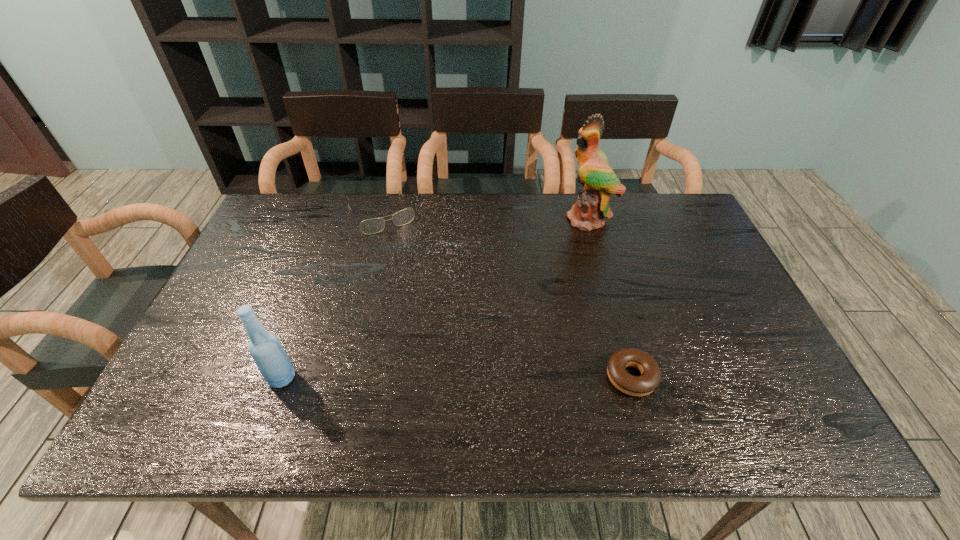
What are the coordinates of `vacant space in between the shortest object and the tallest object` in the screenshot? It's located at (611, 298).

Where is `vacant area that lies between the tallest object and the third tallest object`? This screenshot has width=960, height=540. vacant area that lies between the tallest object and the third tallest object is located at coordinates (486, 217).

You are a GUI agent. You are given a task and a screenshot of the screen. Output one action in this format:
    pyautogui.click(x=<x>, y=<y>)
    Task: Click on the free space between the shortest object and the parrot
    This screenshot has width=960, height=540.
    Given the screenshot: What is the action you would take?
    pyautogui.click(x=611, y=298)

In order to click on object that ranks as the second closest to the bottle in this screenshot , I will do `click(650, 378)`.

In order to click on object that ranks as the closest to the tallest object in this screenshot , I will do `click(650, 378)`.

Locate an element on the screen. free space in the image that satisfies the following two spatial constraints: 1. on the back side of the second tallest object; 2. on the right side of the third tallest object is located at coordinates (342, 214).